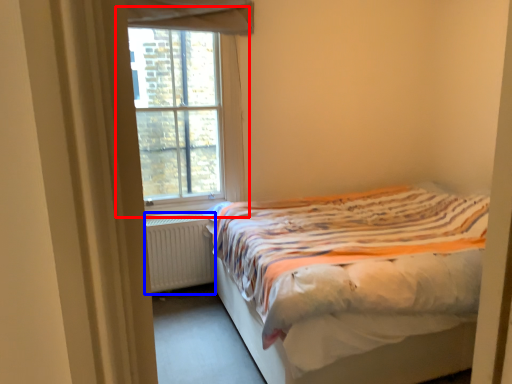
Question: Among these objects, which one is farthest to the camera, window (highlighted by a red box) or radiator (highlighted by a blue box)?

Choices:
 (A) window
 (B) radiator

Answer: (B)